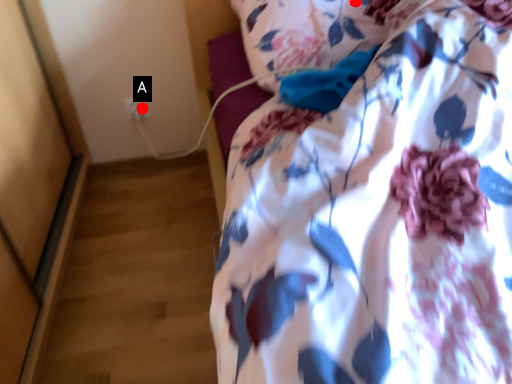
Question: Two points are circled on the image, labeled by A and B beside each circle. Which point is closer to the camera?

Choices:
 (A) A is closer
 (B) B is closer

Answer: (B)